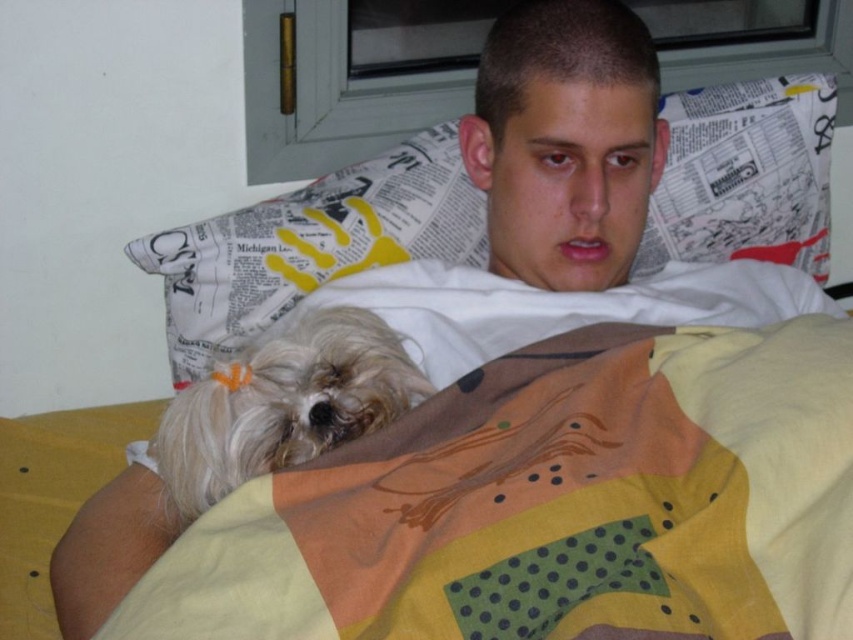
Based on the photo, you are a home assistant and need to determine if the yellow cotton blanket at lower left can completely cover the white fluffy dog at lower left. Based on the scene description, can it?

The yellow cotton blanket at lower left is much taller than the white fluffy dog at lower left, so yes, the yellow cotton blanket at lower left can completely cover the white fluffy dog at lower left.

You are a drone operator trying to deliver a small package to a point closer to the viewer between the two points, point [705,202] and point [216,394]. Which point should you aim for?

Point [705,202] is further to the viewer than point [216,394], so you should aim for point [705,202].

You are a delivery person who needs to place a small package on the bed without disturbing the yellow cotton blanket at lower left. Where should you place the package?

The yellow cotton blanket at lower left is located at point (552, 506), so place the package in an area of the bed that does not overlap with this coordinate to avoid disturbing it.